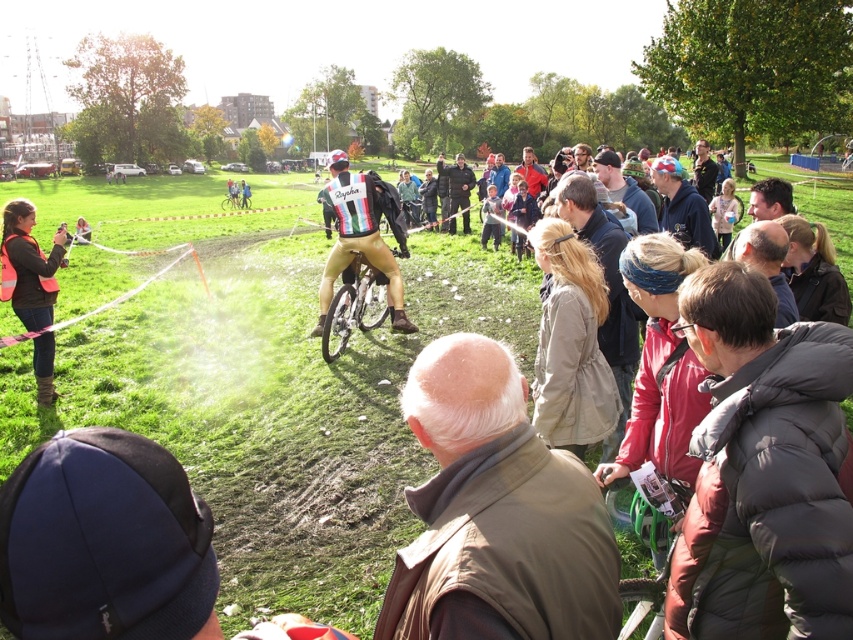
You are a photographer at the cycling event. You want to take a photo that includes both the shiny gold cycling suit at center and the reflective orange vest at left. Which object should you position closer to the front of the frame to ensure both are in focus?

To ensure both the shiny gold cycling suit at center and the reflective orange vest at left are in focus, position the reflective orange vest at left closer to the front of the frame since it is shorter in height than the shiny gold cycling suit at center.

You are a photographer positioned at the camera location. You want to capture a closeup shot of the shiny gold cycling suit at center. Given that your camera can focus on objects within 5 meters, will you be able to take the photo without moving closer?

The shiny gold cycling suit at center is 7.96 meters from camera, which is beyond the camera focus range of 5 meters. Therefore, you cannot take the closeup shot without moving closer.